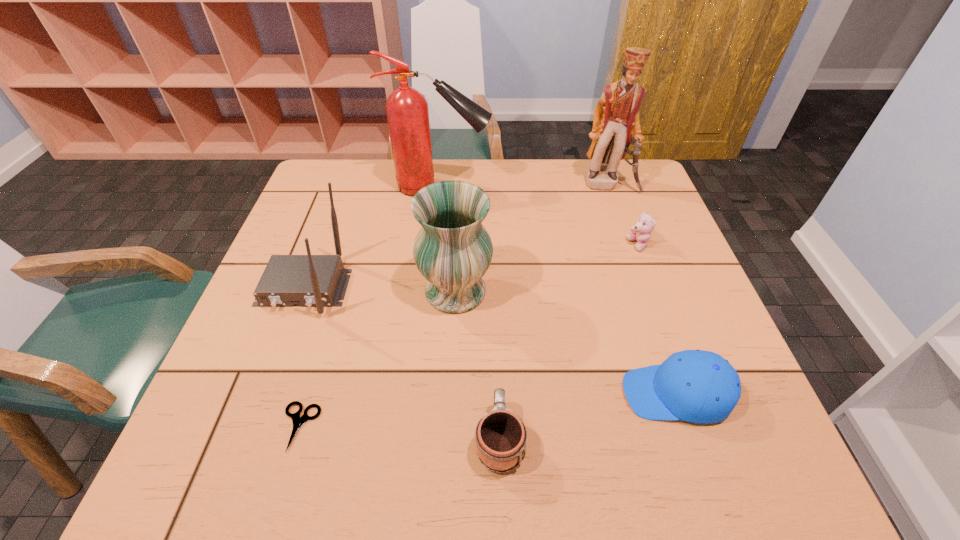
You are a GUI agent. You are given a task and a screenshot of the screen. Output one action in this format:
    pyautogui.click(x=<x>, y=<y>)
    Task: Click on the nutcracker
    Image resolution: width=960 pixels, height=540 pixels.
    Given the screenshot: What is the action you would take?
    pyautogui.click(x=616, y=123)

Where is `fire extinguisher`? The height and width of the screenshot is (540, 960). fire extinguisher is located at coordinates pos(407,112).

Image resolution: width=960 pixels, height=540 pixels. What are the coordinates of `vase` in the screenshot? It's located at (452, 250).

This screenshot has height=540, width=960. In order to click on router in this screenshot , I will do `click(309, 280)`.

Image resolution: width=960 pixels, height=540 pixels. In order to click on cap in this screenshot , I will do `click(697, 386)`.

At what (x,y) coordinates should I click in order to perform the action: click on the sixth nearest object. Please return your answer as a coordinate pair (x, y). Looking at the image, I should click on (641, 232).

Image resolution: width=960 pixels, height=540 pixels. In order to click on mug in this screenshot , I will do `click(500, 437)`.

Find the location of a particular element. The height and width of the screenshot is (540, 960). the shortest object is located at coordinates (298, 421).

Find the location of `free space located on the front-facing side of the nutcracker`. free space located on the front-facing side of the nutcracker is located at coordinates (617, 209).

At what (x,y) coordinates should I click in order to perform the action: click on vacant region located at the nozzle end of the fire extinguisher. Please return your answer as a coordinate pair (x, y). Looking at the image, I should click on (567, 187).